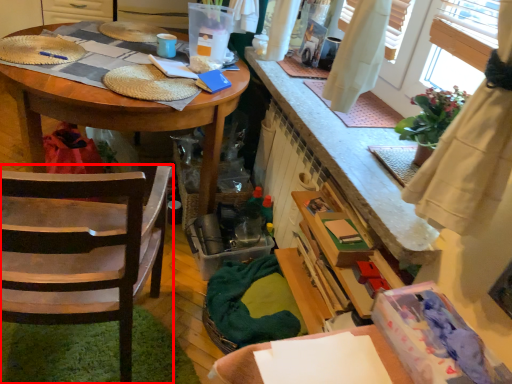
Question: From the image's perspective, what is the correct spatial relationship of chair (annotated by the red box) in relation to desk?

Choices:
 (A) below
 (B) above

Answer: (A)